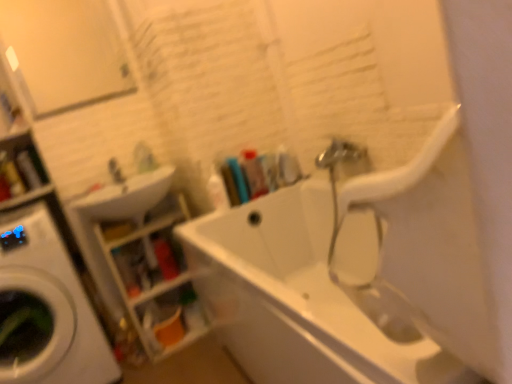
The width and height of the screenshot is (512, 384). Identify the location of translucent plastic bottle at center, the 1th toiletry positioned from the right. (254, 174).

Image resolution: width=512 pixels, height=384 pixels. Describe the element at coordinates (52, 304) in the screenshot. I see `white glossy washing machine at left` at that location.

What is the approximate width of translucent plastic bottle at center, positioned as the third toiletry in right-to-left order?

translucent plastic bottle at center, positioned as the third toiletry in right-to-left order, is 2.67 inches in width.

What do you see at coordinates (28, 170) in the screenshot? This screenshot has width=512, height=384. I see `translucent plastic bottle at upper left, which is the 4th toiletry from right to left` at bounding box center [28, 170].

Measure the distance between point [239,171] and camera.

The depth of point [239,171] is 6.38 feet.

This screenshot has width=512, height=384. I want to click on white glossy sink at upper left, so click(x=123, y=198).

I want to click on translucent plastic bottle at center, which is the fourth toiletry from left to right, so click(x=254, y=174).

Which object is further away from the camera, translucent plastic shelves at lower left or translucent plastic toothbrushes at upper center, which appears as the second toiletry when viewed from the right?

Positioned behind is translucent plastic shelves at lower left.

Is translucent plastic shelves at lower left oriented towards translucent plastic toothbrushes at upper center, which appears as the 3th toiletry when viewed from the left?

No, translucent plastic shelves at lower left does not turn towards translucent plastic toothbrushes at upper center, which appears as the 3th toiletry when viewed from the left.

In terms of width, does translucent plastic shelves at lower left look wider or thinner when compared to translucent plastic toothbrushes at upper center, which appears as the second toiletry when viewed from the right?

Clearly, translucent plastic shelves at lower left has more width compared to translucent plastic toothbrushes at upper center, which appears as the second toiletry when viewed from the right.

From a real-world perspective, which object stands above the other?

satin nickel faucet at upper left is physically above.

Considering the relative positions of satin nickel faucet at upper left and translucent plastic bottle at center, the 1th toiletry positioned from the right, in the image provided, is satin nickel faucet at upper left to the right of translucent plastic bottle at center, the 1th toiletry positioned from the right, from the viewer's perspective?

No.

Would you say satin nickel faucet at upper left contains translucent plastic bottle at center, which is the fourth toiletry from left to right?

Actually, translucent plastic bottle at center, which is the fourth toiletry from left to right, is outside satin nickel faucet at upper left.

From the image's perspective, which one is positioned lower, satin nickel faucet at upper left or translucent plastic bottle at center, the 1th toiletry positioned from the right?

satin nickel faucet at upper left, from the image's perspective.

Visually, is translucent plastic toothbrushes at upper center, which appears as the 3th toiletry when viewed from the left, positioned to the left or to the right of translucent plastic bottle at upper left, acting as the first toiletry starting from the left?

Based on their positions, translucent plastic toothbrushes at upper center, which appears as the 3th toiletry when viewed from the left, is located to the right of translucent plastic bottle at upper left, acting as the first toiletry starting from the left.

From the picture: Can we say translucent plastic toothbrushes at upper center, which appears as the 3th toiletry when viewed from the left, lies outside translucent plastic bottle at upper left, which is the 4th toiletry from right to left?

Yes.

Can you confirm if translucent plastic toothbrushes at upper center, which appears as the second toiletry when viewed from the right, is taller than translucent plastic bottle at upper left, acting as the first toiletry starting from the left?

No.

At what (x,y) coordinates should I click in order to perform the action: click on the 2nd toiletry behind the white glossy washing machine at left, starting your count from the anchor. Please return your answer as a coordinate pair (x, y). Looking at the image, I should click on (238, 179).

Which object is closer to the camera taking this photo, white glossy washing machine at left or translucent plastic toothbrushes at upper center, which appears as the second toiletry when viewed from the right?

Positioned in front is white glossy washing machine at left.

Based on the photo, does translucent plastic bottle at upper left, acting as the first toiletry starting from the left, have a lesser width compared to white glossy bathtub at center?

Yes, translucent plastic bottle at upper left, acting as the first toiletry starting from the left, is thinner than white glossy bathtub at center.

Is white glossy bathtub at center at the back of translucent plastic bottle at upper left, acting as the first toiletry starting from the left?

translucent plastic bottle at upper left, acting as the first toiletry starting from the left, does not have its back to white glossy bathtub at center.

Which is nearer, (29, 173) or (197, 259)?

Clearly, point (29, 173) is more distant from the camera than point (197, 259).

Where is `bathtub on the right of translucent plastic bottle at upper left, acting as the first toiletry starting from the left`? bathtub on the right of translucent plastic bottle at upper left, acting as the first toiletry starting from the left is located at coordinates (350, 275).

From a real-world perspective, which is physically above, translucent plastic bottle at center, positioned as the third toiletry in right-to-left order, or translucent plastic bottle at upper left, which is the 4th toiletry from right to left?

translucent plastic bottle at upper left, which is the 4th toiletry from right to left.

Is translucent plastic bottle at center, positioned as the third toiletry in right-to-left order, smaller than translucent plastic bottle at upper left, acting as the first toiletry starting from the left?

Indeed, translucent plastic bottle at center, positioned as the third toiletry in right-to-left order, has a smaller size compared to translucent plastic bottle at upper left, acting as the first toiletry starting from the left.

Is translucent plastic bottle at center, placed as the second toiletry when sorted from left to right, in front of or behind translucent plastic bottle at upper left, which is the 4th toiletry from right to left, in the image?

In the image, translucent plastic bottle at center, placed as the second toiletry when sorted from left to right, appears in front of translucent plastic bottle at upper left, which is the 4th toiletry from right to left.

Is point (212, 176) closer or farther from the camera than point (25, 172)?

Clearly, point (212, 176) is closer to the camera than point (25, 172).

Which object is positioned more to the left, white glossy bathtub at center or white glossy sink at upper left?

white glossy sink at upper left is more to the left.

From the image's perspective, is white glossy bathtub at center positioned above or below white glossy sink at upper left?

white glossy bathtub at center is situated lower than white glossy sink at upper left in the image.

Is white glossy bathtub at center positioned with its back to white glossy sink at upper left?

No, white glossy bathtub at center is not facing the opposite direction of white glossy sink at upper left.

Which is behind, point (448, 306) or point (170, 179)?

The point (170, 179) is behind.

From a real-world perspective, starting from the translucent plastic shelves at lower left, which toiletry is the 1st one vertically above it? Please provide its 2D coordinates.

[(238, 179)]

Find the location of a particular element. This screenshot has height=384, width=512. faucet on the left of translucent plastic bottle at center, which is the fourth toiletry from left to right is located at coordinates (116, 172).

Which object lies further to the anchor point white glossy sink at upper left, white glossy bathtub at center or translucent plastic bottle at upper left, which is the 4th toiletry from right to left?

white glossy bathtub at center is positioned further to the anchor white glossy sink at upper left.

Considering their positions, is translucent plastic shelves at lower left positioned further to translucent plastic bottle at center, the 1th toiletry positioned from the right, than translucent plastic bottle at center, positioned as the third toiletry in right-to-left order?

translucent plastic shelves at lower left is positioned further to the anchor translucent plastic bottle at center, the 1th toiletry positioned from the right.

Based on the photo, considering their positions, is white glossy sink at upper left positioned further to satin nickel faucet at upper left than translucent plastic bottle at center, placed as the second toiletry when sorted from left to right?

The object further to satin nickel faucet at upper left is translucent plastic bottle at center, placed as the second toiletry when sorted from left to right.

When comparing their distances from satin nickel faucet at upper left, does white glossy bathtub at center or translucent plastic shelves at lower left seem closer?

translucent plastic shelves at lower left is closer to satin nickel faucet at upper left.

From the image, which object appears to be nearer to translucent plastic bottle at center, the 1th toiletry positioned from the right, white glossy bathtub at center or white glossy washing machine at left?

Among the two, white glossy bathtub at center is located nearer to translucent plastic bottle at center, the 1th toiletry positioned from the right.

In the scene shown: Looking at the image, which one is located further to translucent plastic bottle at upper left, which is the 4th toiletry from right to left, white glossy sink at upper left or satin nickel faucet at upper left?

Based on the image, white glossy sink at upper left appears to be further to translucent plastic bottle at upper left, which is the 4th toiletry from right to left.

Estimate the real-world distances between objects in this image. Which object is further from white glossy sink at upper left, satin nickel faucet at upper left or translucent plastic bottle at center, placed as the second toiletry when sorted from left to right?

The object further to white glossy sink at upper left is translucent plastic bottle at center, placed as the second toiletry when sorted from left to right.

Considering their positions, is white glossy bathtub at center positioned closer to satin nickel faucet at upper left than translucent plastic toothbrushes at upper center, which appears as the 3th toiletry when viewed from the left?

Among the two, translucent plastic toothbrushes at upper center, which appears as the 3th toiletry when viewed from the left, is located nearer to satin nickel faucet at upper left.

Image resolution: width=512 pixels, height=384 pixels. What are the coordinates of `faucet between translucent plastic bottle at upper left, acting as the first toiletry starting from the left, and translucent plastic bottle at center, the 1th toiletry positioned from the right, from left to right` in the screenshot? It's located at (116, 172).

The width and height of the screenshot is (512, 384). I want to click on faucet between white glossy washing machine at left and translucent plastic bottle at center, placed as the second toiletry when sorted from left to right, so 116,172.

Where is `shelf between satin nickel faucet at upper left and translucent plastic toothbrushes at upper center, which appears as the 3th toiletry when viewed from the left`? shelf between satin nickel faucet at upper left and translucent plastic toothbrushes at upper center, which appears as the 3th toiletry when viewed from the left is located at coordinates (155, 278).

Find the location of a particular element. toiletry between white glossy bathtub at center and translucent plastic toothbrushes at upper center, which appears as the second toiletry when viewed from the right, along the z-axis is located at coordinates (218, 191).